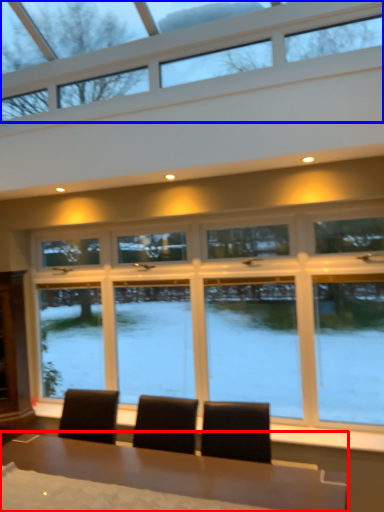
Question: Which object is further to the camera taking this photo, table (highlighted by a red box) or window (highlighted by a blue box)?

Choices:
 (A) table
 (B) window

Answer: (A)